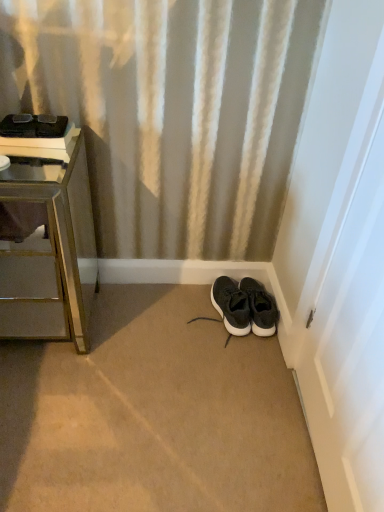
The image size is (384, 512). I want to click on free space between white glossy door at right and black fabric sneakers at center, the first footwear viewed from the left, so click(268, 390).